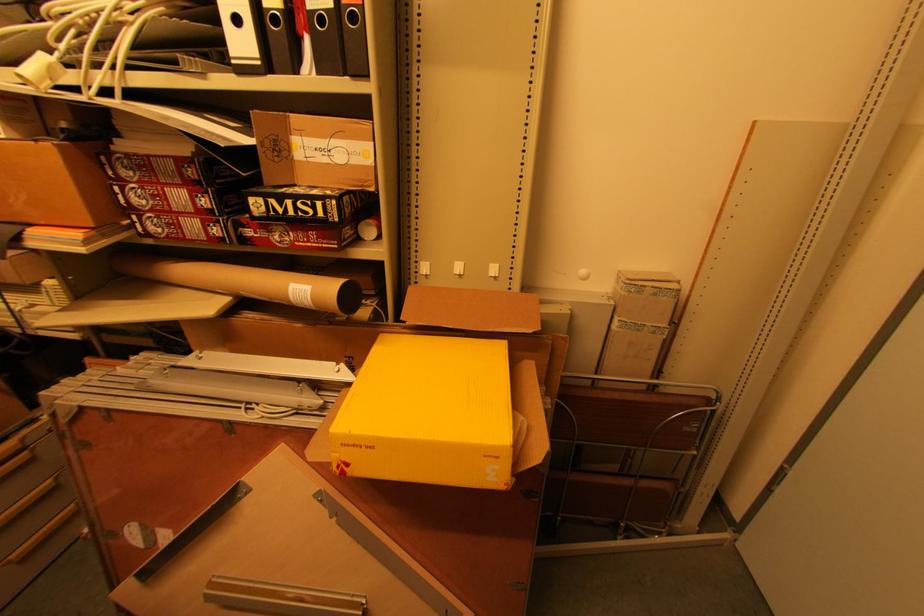
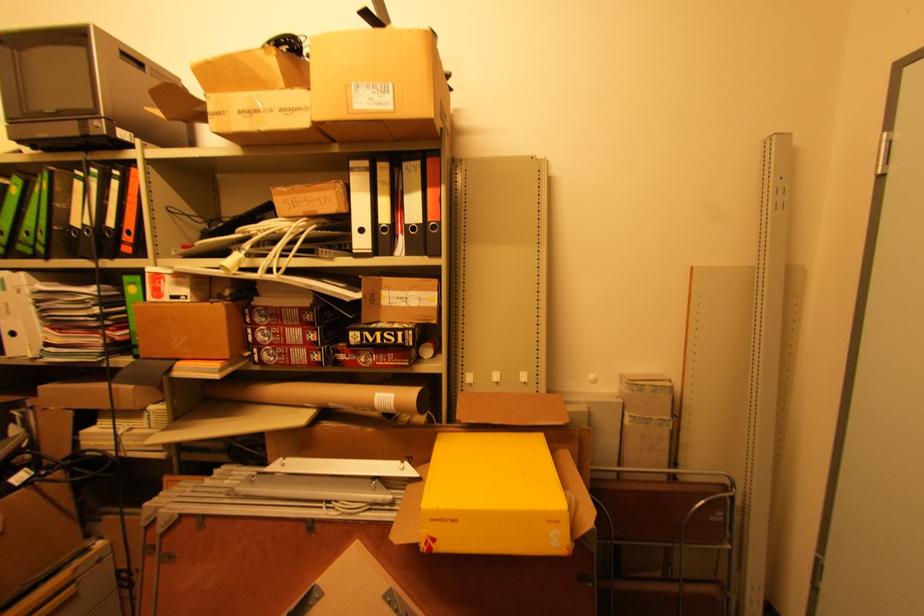
Find the pixel in the second image that matches point (130, 223) in the first image.

(251, 354)